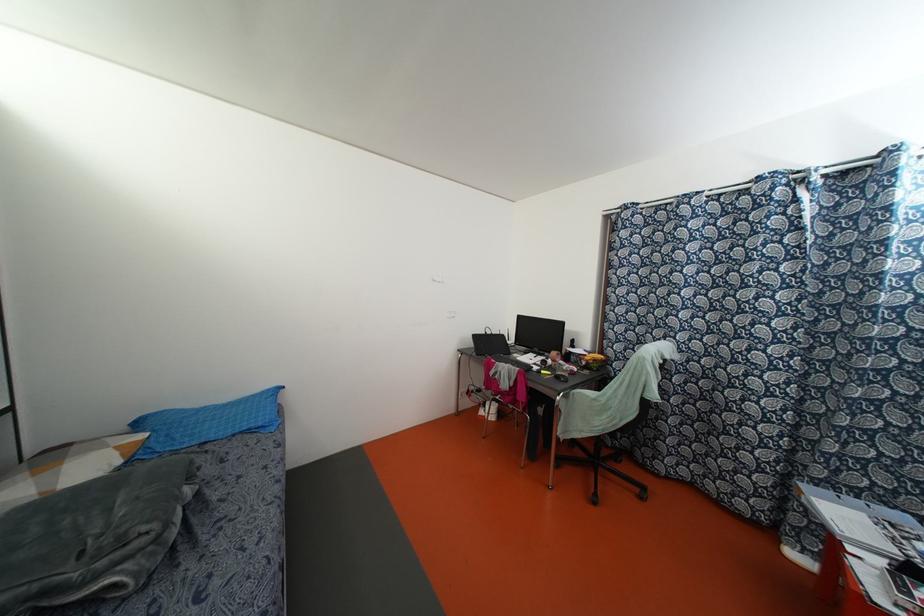
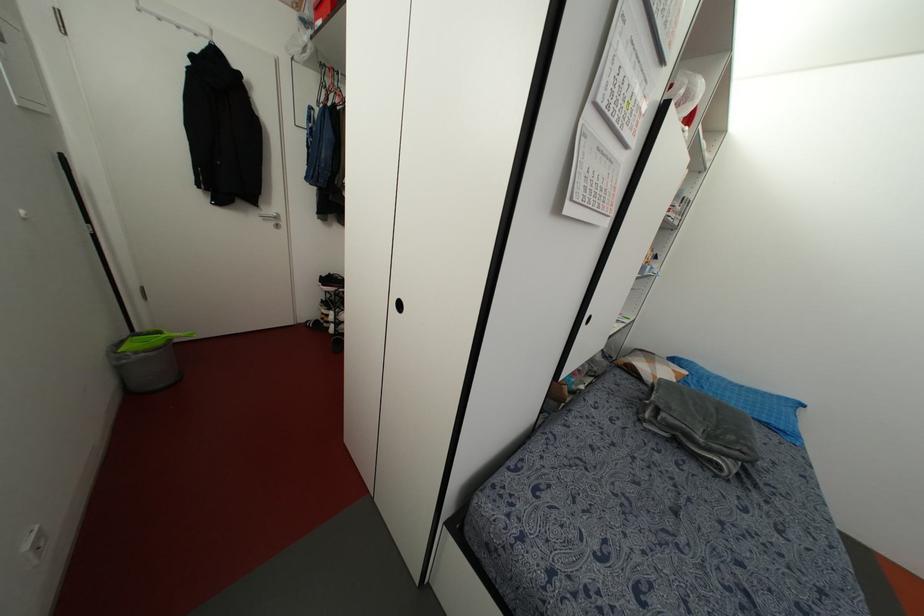
The first image is from the beginning of the video and the second image is from the end. How did the camera likely rotate when shooting the video?

The rotation direction of the camera is left-down.